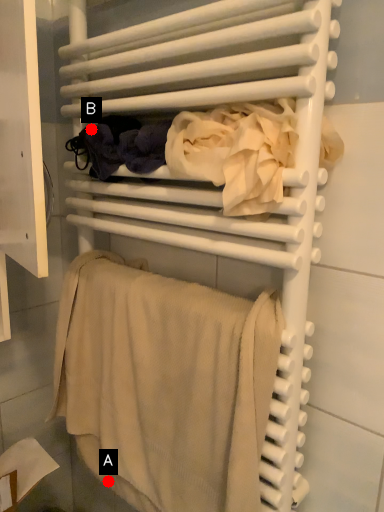
Question: Two points are circled on the image, labeled by A and B beside each circle. Which point appears farthest from the camera in this image?

Choices:
 (A) A is further
 (B) B is further

Answer: (A)